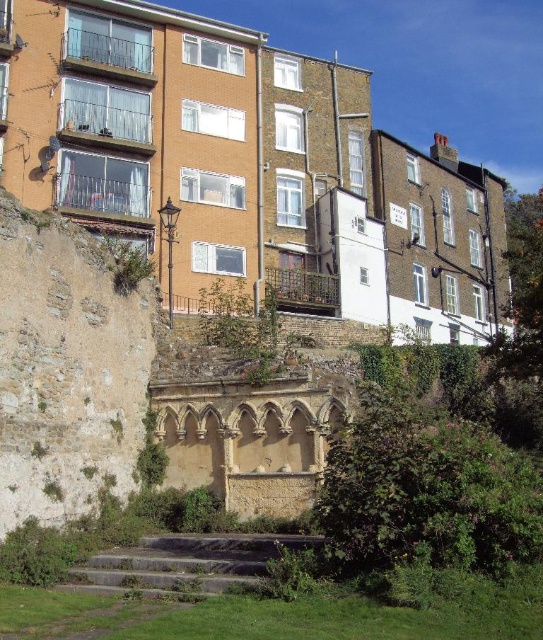
This screenshot has width=543, height=640. What do you see at coordinates (66, 369) in the screenshot? I see `weathered stone wall at lower left` at bounding box center [66, 369].

Between weathered stone wall at lower left and granite steps at lower center, which one has less height?

granite steps at lower center is shorter.

Is point (4, 380) positioned behind point (108, 554)?

No, it is not.

Locate an element on the screen. weathered stone wall at lower left is located at coordinates (66, 369).

Looking at this image, can you confirm if clear glass balcony at upper left is taller than metallic silver balcony at center?

In fact, clear glass balcony at upper left may be shorter than metallic silver balcony at center.

Is point (77, 100) positioned after point (286, 307)?

No, (77, 100) is in front of (286, 307).

Between point (116, 108) and point (282, 305), which one is positioned in front?

Point (282, 305) is in front.

Where is `clear glass balcony at upper left`? clear glass balcony at upper left is located at coordinates (106, 125).

Between point (217, 554) and point (77, 193), which one is positioned in front?

Point (217, 554) is more forward.

Is granite steps at lower center above clear glass balcony at left?

Actually, granite steps at lower center is below clear glass balcony at left.

Does point (236, 541) come farther from viewer compared to point (77, 204)?

No, it is not.

Locate an element on the screen. granite steps at lower center is located at coordinates (186, 563).